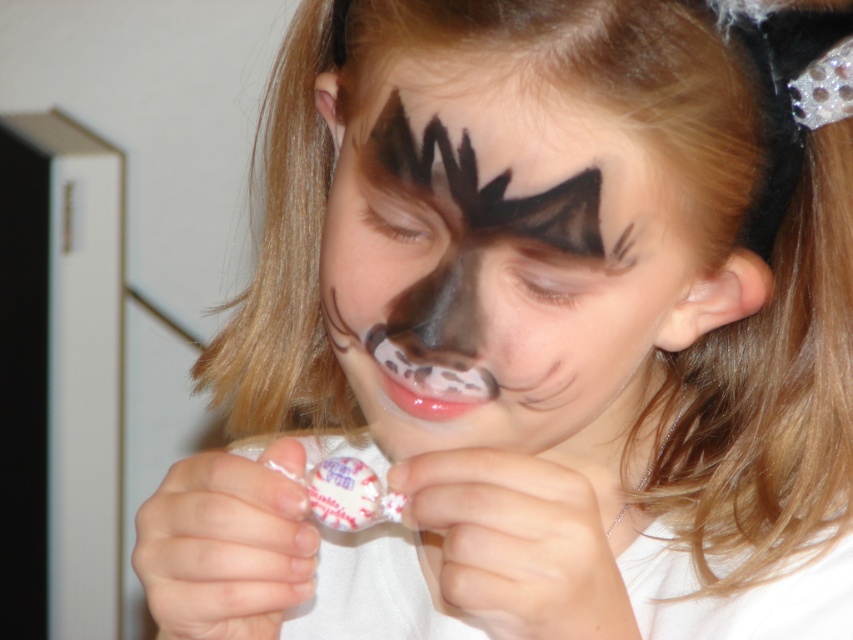
Is matte black face paint at center further to camera compared to matte black nose at center?

No, matte black face paint at center is closer to the viewer.

Is matte black face paint at center below matte black nose at center?

Actually, matte black face paint at center is above matte black nose at center.

Where is `matte black face paint at center`? The image size is (853, 640). matte black face paint at center is located at coordinates 492,257.

Which of these two, matte black face paint at center or black matte eyebrow at upper center, stands taller?

Standing taller between the two is matte black face paint at center.

This screenshot has width=853, height=640. What do you see at coordinates (492, 257) in the screenshot?
I see `matte black face paint at center` at bounding box center [492, 257].

Is point (376, 326) closer to camera compared to point (618, 260)?

No, (376, 326) is further to viewer.

Locate an element on the screen. The height and width of the screenshot is (640, 853). matte black face paint at center is located at coordinates (492, 257).

Does point (524, 202) lie behind point (454, 340)?

That is False.

Looking at this image, can you confirm if black matte/soft eyebrow at upper center is positioned to the left of matte black nose at center?

Incorrect, black matte/soft eyebrow at upper center is not on the left side of matte black nose at center.

Is point (554, 234) more distant than point (378, 333)?

No, (554, 234) is in front of (378, 333).

Locate an element on the screen. black matte/soft eyebrow at upper center is located at coordinates (486, 177).